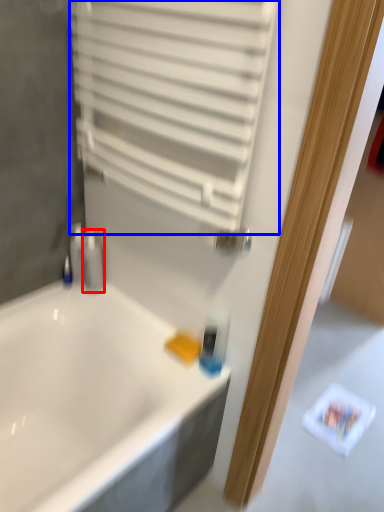
Question: Which object is closer to the camera taking this photo, toiletry (highlighted by a red box) or shutter (highlighted by a blue box)?

Choices:
 (A) toiletry
 (B) shutter

Answer: (B)